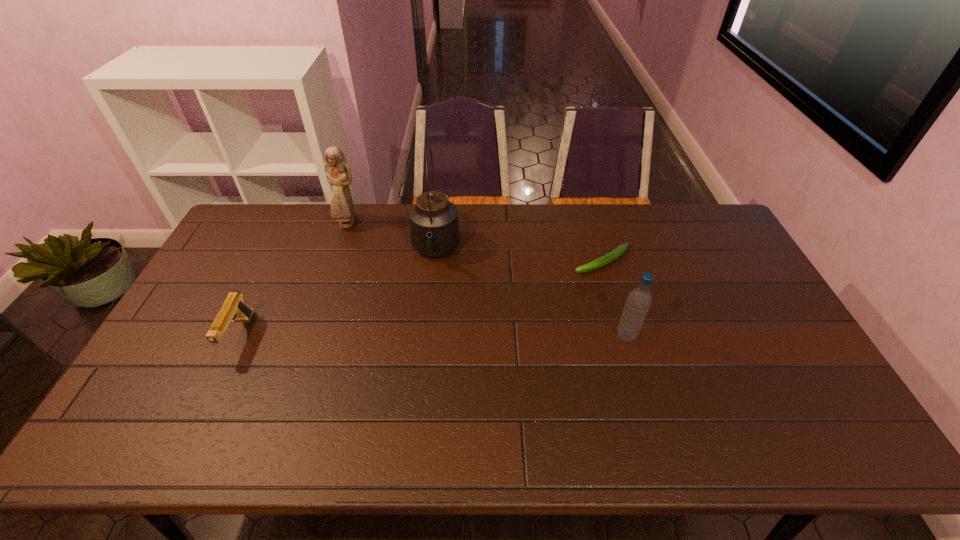
Image resolution: width=960 pixels, height=540 pixels. Identify the location of figurine present at the far edge. (337, 170).

Identify the location of vacant space at the far edge. The width and height of the screenshot is (960, 540). (600, 237).

At what (x,y) coordinates should I click in order to perform the action: click on vacant space at the near edge. Please return your answer as a coordinate pair (x, y). Looking at the image, I should click on (696, 404).

This screenshot has height=540, width=960. Identify the location of vacant space at the near left corner of the desktop. (159, 407).

At what (x,y) coordinates should I click in order to perform the action: click on vacant space at the near right corner of the desktop. Please return your answer as a coordinate pair (x, y). Looking at the image, I should click on (792, 405).

Where is `vacant region between the third shortest object and the second shortest object`? The image size is (960, 540). vacant region between the third shortest object and the second shortest object is located at coordinates click(433, 336).

Image resolution: width=960 pixels, height=540 pixels. I want to click on empty location between the tallest object and the fourth shortest object, so click(x=393, y=237).

This screenshot has width=960, height=540. In order to click on vacant area that lies between the figurine and the kettle in this screenshot , I will do `click(393, 237)`.

Find the location of a particular element. vacant space in between the tallest object and the zucchini is located at coordinates (518, 256).

Identify the location of free point between the figurine and the fourth tallest object. (294, 279).